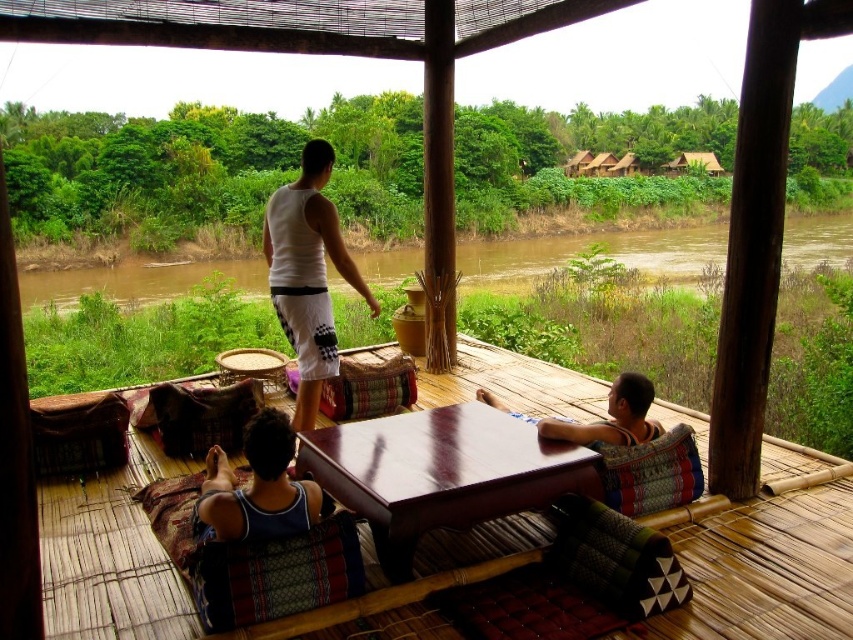
You are a guest at this riverside deck and want to place a tall vase on the wooden table at center. The vase is taller than the blue fabric at lower left. Will the vase fit on the table without touching the blue fabric?

The wooden table at center is not as tall as the blue fabric at lower left. Since the vase is taller than the blue fabric, it will exceed the table height, so the vase may touch or go beyond the blue fabric.